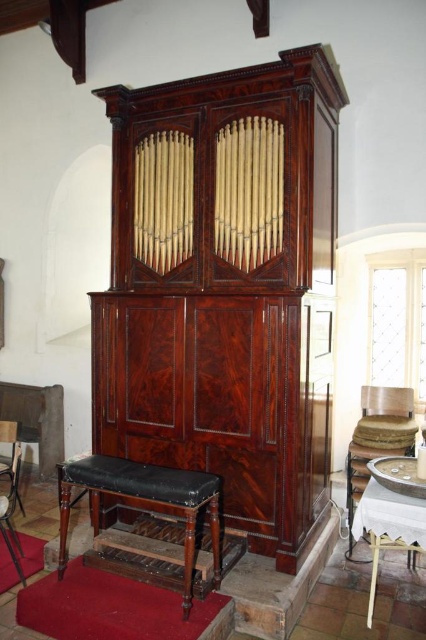
Can you confirm if mahogany leather stool at lower left is bigger than smooth black leather bench at lower left?

Indeed, mahogany leather stool at lower left has a larger size compared to smooth black leather bench at lower left.

Can you confirm if mahogany leather stool at lower left is smaller than smooth black leather bench at lower left?

Actually, mahogany leather stool at lower left might be larger than smooth black leather bench at lower left.

Between point (129, 499) and point (5, 474), which one is positioned behind?

Positioned behind is point (5, 474).

You are a GUI agent. You are given a task and a screenshot of the screen. Output one action in this format:
    pyautogui.click(x=<x>, y=<y>)
    Task: Click on the mahogany leather stool at lower left
    
    Given the screenshot: What is the action you would take?
    pyautogui.click(x=144, y=502)

Is mahogany wood pipe organ at center bigger than smooth black leather bench at lower left?

Yes.

Looking at this image, can you confirm if mahogany wood pipe organ at center is shorter than smooth black leather bench at lower left?

In fact, mahogany wood pipe organ at center may be taller than smooth black leather bench at lower left.

Is point (186, 92) positioned in front of point (14, 461)?

That is True.

Locate an element on the screen. This screenshot has height=640, width=426. mahogany wood pipe organ at center is located at coordinates (224, 289).

The width and height of the screenshot is (426, 640). What do you see at coordinates (224, 289) in the screenshot?
I see `mahogany wood pipe organ at center` at bounding box center [224, 289].

Between mahogany wood pipe organ at center and mahogany leather stool at lower left, which one is positioned higher?

mahogany wood pipe organ at center

Which is in front, point (175, 106) or point (108, 481)?

Point (108, 481) is more forward.

This screenshot has height=640, width=426. Identify the location of mahogany wood pipe organ at center. pos(224,289).